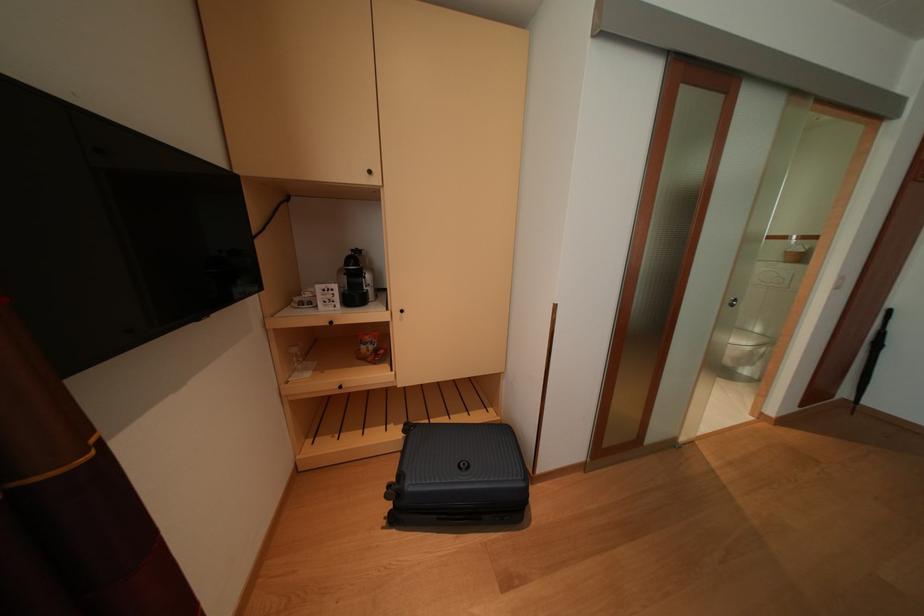
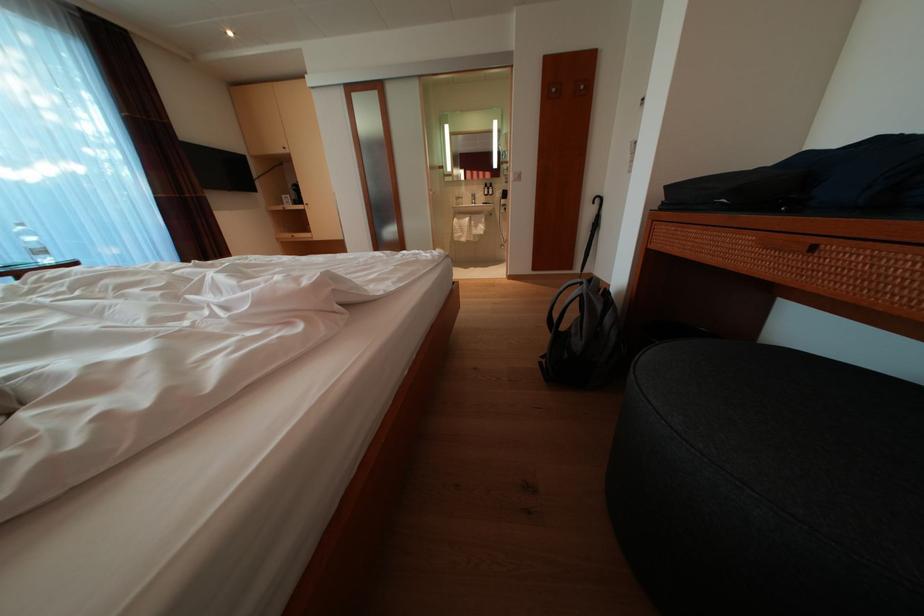
In the scene shown: Which direction would the cameraman need to move to produce the second image?

The cameraman walked toward right, backward.